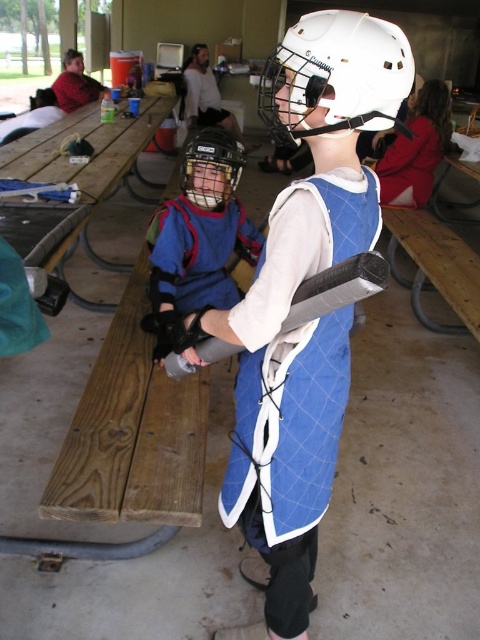
Question: Does blue padded vest at center appear under matte black helmet at center?

Choices:
 (A) no
 (B) yes

Answer: (B)

Question: Which of the following is the closest to the observer?

Choices:
 (A) white matte helmet at center
 (B) matte black helmet at center

Answer: (A)

Question: Does white matte helmet at center come in front of matte black helmet at center?

Choices:
 (A) yes
 (B) no

Answer: (A)

Question: Which point is farther to the camera?

Choices:
 (A) (214, 173)
 (B) (172, 244)

Answer: (B)

Question: Which point is closer to the camera?

Choices:
 (A) (202, 156)
 (B) (351, 83)
 (C) (328, 131)

Answer: (B)

Question: Is blue quilted vest at center positioned at the back of blue padded vest at center?

Choices:
 (A) yes
 (B) no

Answer: (B)